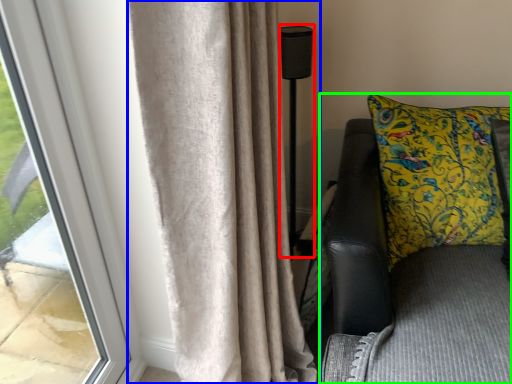
Question: Which is nearer to the lamp (highlighted by a red box)? curtain (highlighted by a blue box) or furniture (highlighted by a green box).

Choices:
 (A) curtain
 (B) furniture

Answer: (B)